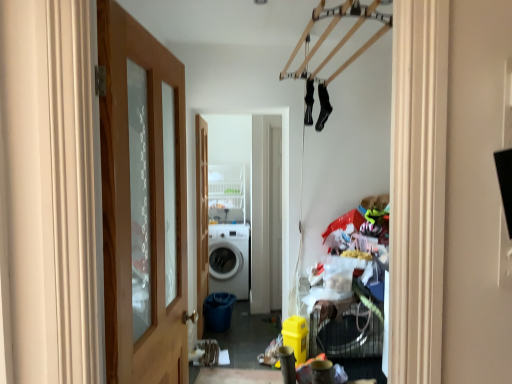
Question: Considering the relative sizes of wooden door at center, which is the second door in front-to-back order, and wooden door at left, acting as the second door starting from the left, in the image provided, is wooden door at center, which is the second door in front-to-back order, wider than wooden door at left, acting as the second door starting from the left,?

Choices:
 (A) no
 (B) yes

Answer: (A)

Question: From the image's perspective, is wooden door at center, acting as the first door starting from the back, on wooden door at left, acting as the second door starting from the left?

Choices:
 (A) yes
 (B) no

Answer: (B)

Question: Is wooden door at left, which is the 2th door from back to front, completely or partially inside wooden door at center, acting as the first door starting from the back?

Choices:
 (A) yes
 (B) no

Answer: (B)

Question: Is wooden door at center, arranged as the 1th door when viewed from the left, directly adjacent to wooden door at left, the first door when ordered from right to left?

Choices:
 (A) yes
 (B) no

Answer: (B)

Question: Considering the relative sizes of wooden door at center, arranged as the 1th door when viewed from the left, and wooden door at left, which appears as the first door when viewed from the front, in the image provided, is wooden door at center, arranged as the 1th door when viewed from the left, thinner than wooden door at left, which appears as the first door when viewed from the front,?

Choices:
 (A) yes
 (B) no

Answer: (A)

Question: Considering the relative positions of wooden door at center, the second door in the right-to-left sequence, and wooden door at left, which is the 2th door from back to front, in the image provided, is wooden door at center, the second door in the right-to-left sequence, to the left of wooden door at left, which is the 2th door from back to front, from the viewer's perspective?

Choices:
 (A) no
 (B) yes

Answer: (B)

Question: Can you confirm if wooden door at left, which appears as the first door when viewed from the front, is bigger than white matte washing machine at center?

Choices:
 (A) no
 (B) yes

Answer: (A)

Question: Considering the relative positions of wooden door at left, which is the 2th door from back to front, and white matte washing machine at center in the image provided, is wooden door at left, which is the 2th door from back to front, to the left of white matte washing machine at center from the viewer's perspective?

Choices:
 (A) no
 (B) yes

Answer: (B)

Question: Could you tell me if wooden door at left, the first door when ordered from right to left, is facing white matte washing machine at center?

Choices:
 (A) yes
 (B) no

Answer: (B)

Question: Is wooden door at left, which appears as the first door when viewed from the front, looking in the opposite direction of white matte washing machine at center?

Choices:
 (A) no
 (B) yes

Answer: (A)

Question: Is wooden door at left, which is the 2th door from back to front, directly adjacent to white matte washing machine at center?

Choices:
 (A) yes
 (B) no

Answer: (B)

Question: Does wooden door at left, which appears as the first door when viewed from the front, lie behind white matte washing machine at center?

Choices:
 (A) no
 (B) yes

Answer: (A)

Question: Considering the relative sizes of white matte washing machine at center and wooden door at center, arranged as the 1th door when viewed from the left, in the image provided, is white matte washing machine at center wider than wooden door at center, arranged as the 1th door when viewed from the left,?

Choices:
 (A) no
 (B) yes

Answer: (B)